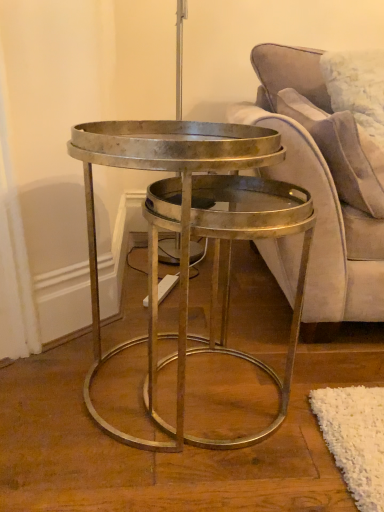
Question: Is metallic/golden coffee table at center oriented away from suede-like beige pillow at upper right?

Choices:
 (A) yes
 (B) no

Answer: (B)

Question: Is metallic/golden coffee table at center further to the viewer compared to suede-like beige pillow at upper right?

Choices:
 (A) no
 (B) yes

Answer: (A)

Question: Is metallic/golden coffee table at center to the right of suede-like beige pillow at upper right from the viewer's perspective?

Choices:
 (A) yes
 (B) no

Answer: (B)

Question: From the image's perspective, is metallic/golden coffee table at center on suede-like beige pillow at upper right?

Choices:
 (A) yes
 (B) no

Answer: (B)

Question: Considering the relative sizes of metallic/golden coffee table at center and suede-like beige pillow at upper right in the image provided, is metallic/golden coffee table at center taller than suede-like beige pillow at upper right?

Choices:
 (A) yes
 (B) no

Answer: (A)

Question: Considering the positions of metallic/golden coffee table at center and suede-like beige pillow at upper right in the image, is metallic/golden coffee table at center wider or thinner than suede-like beige pillow at upper right?

Choices:
 (A) wide
 (B) thin

Answer: (A)

Question: From a real-world perspective, is metallic/golden coffee table at center above or below suede-like beige pillow at upper right?

Choices:
 (A) below
 (B) above

Answer: (A)

Question: Is metallic/golden coffee table at center in front of or behind suede-like beige pillow at upper right in the image?

Choices:
 (A) front
 (B) behind

Answer: (A)

Question: Considering the relative positions of metallic/golden coffee table at center and suede-like beige pillow at upper right in the image provided, is metallic/golden coffee table at center to the left or to the right of suede-like beige pillow at upper right?

Choices:
 (A) left
 (B) right

Answer: (A)

Question: Based on their positions, is velvet purple couch at right located to the left or right of metallic/golden coffee table at center?

Choices:
 (A) right
 (B) left

Answer: (A)

Question: Is velvet purple couch at right wider or thinner than metallic/golden coffee table at center?

Choices:
 (A) wide
 (B) thin

Answer: (A)

Question: Is velvet purple couch at right bigger or smaller than metallic/golden coffee table at center?

Choices:
 (A) big
 (B) small

Answer: (A)

Question: From the image's perspective, is velvet purple couch at right above or below metallic/golden coffee table at center?

Choices:
 (A) above
 (B) below

Answer: (A)

Question: From a real-world perspective, relative to velvet purple couch at right, is metallic/golden coffee table at center vertically above or below?

Choices:
 (A) below
 (B) above

Answer: (A)

Question: Looking at their shapes, would you say metallic/golden coffee table at center is wider or thinner than velvet purple couch at right?

Choices:
 (A) thin
 (B) wide

Answer: (A)